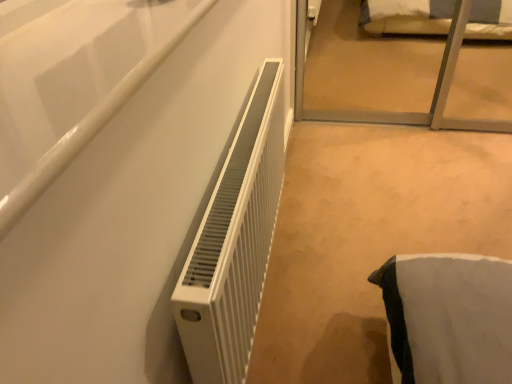
The image size is (512, 384). In order to click on white matte radiator at center in this screenshot , I will do `click(234, 243)`.

From the picture: What is the approximate height of white matte radiator at center?

white matte radiator at center is 18.93 inches in height.

Image resolution: width=512 pixels, height=384 pixels. What do you see at coordinates (234, 243) in the screenshot?
I see `white matte radiator at center` at bounding box center [234, 243].

In order to face white matte radiator at center, should I rotate leftwards or rightwards?

Turn left approximately 0.252 degrees to face it.

Where is `white matte radiator at center`? Image resolution: width=512 pixels, height=384 pixels. white matte radiator at center is located at coordinates (234, 243).